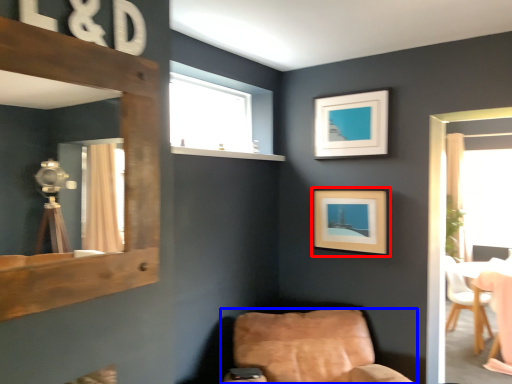
Question: Which of the following is the farthest to the observer, picture frame (highlighted by a red box) or chair (highlighted by a blue box)?

Choices:
 (A) picture frame
 (B) chair

Answer: (A)